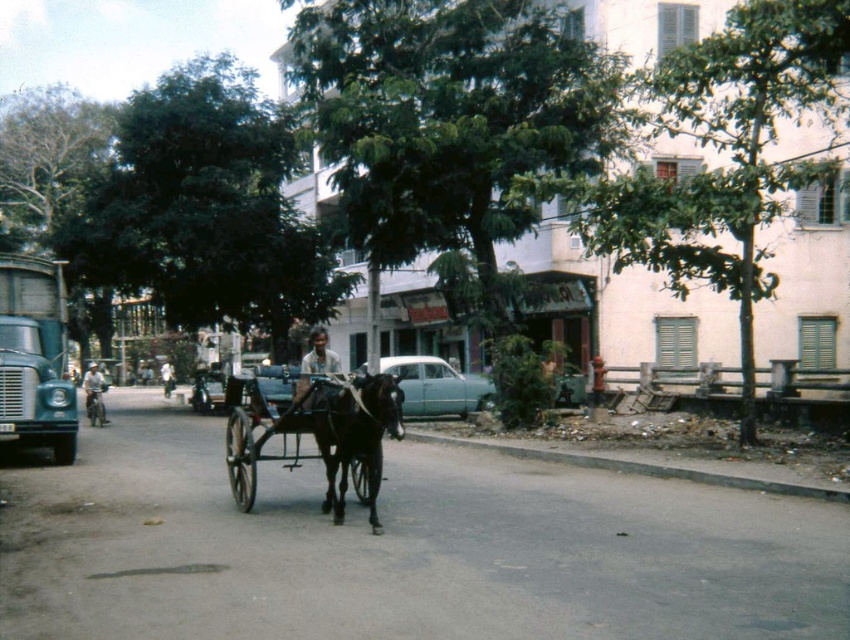
Consider the image. You are a delivery person who needs to deliver a package to the shiny black cart at center. You are currently standing next to the white matte shirt at center. Can you walk directly to the cart without needing to go around any obstacles? Explain your reasoning based on the distance between them.

The shiny black cart at center and white matte shirt at center are 43.14 meters apart. Since there is no mention of obstacles between them in the scene description, you can walk directly to the cart.

You are a pedestrian standing on the sidewalk and see the shiny black cart at center being pulled by the black glossy horse at center. Which one is closer to you?

The shiny black cart at center is closer to you because the black glossy horse at center is behind it.